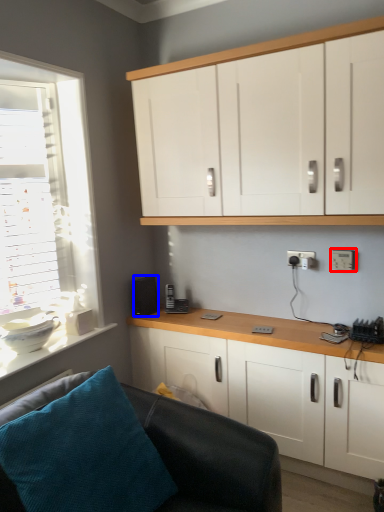
Question: Among these objects, which one is nearest to the camera, electric outlet (highlighted by a red box) or speaker (highlighted by a blue box)?

Choices:
 (A) electric outlet
 (B) speaker

Answer: (A)